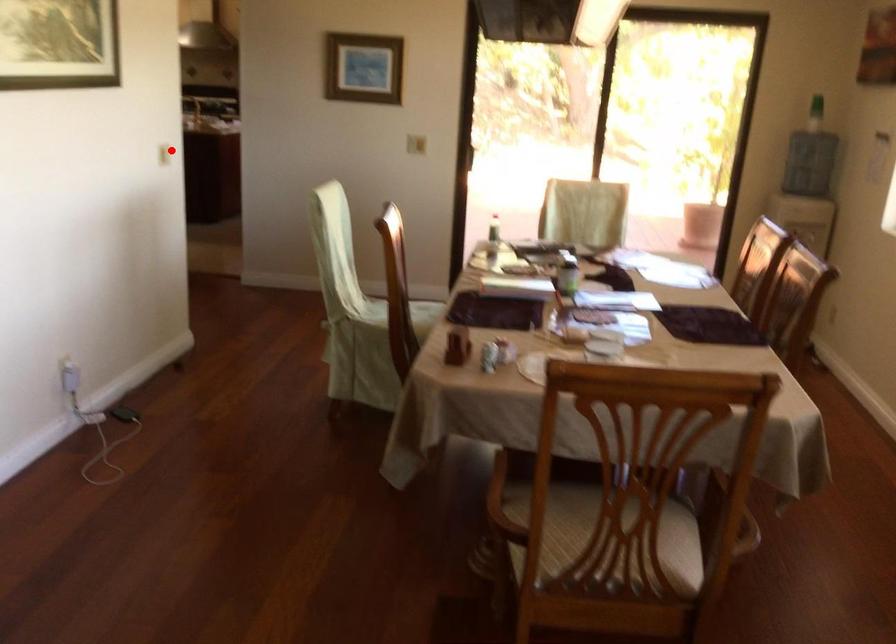
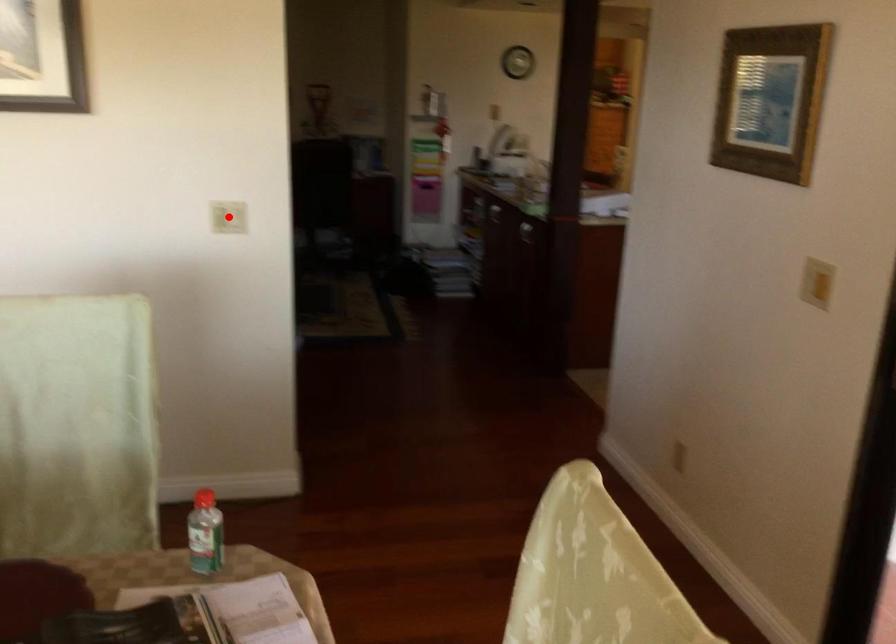
I am providing you with two images of the same scene from different viewpoints. A red point is marked on the first image and another point is marked on the second image. Is the red point in image1 aligned with the point shown in image2?

Yes